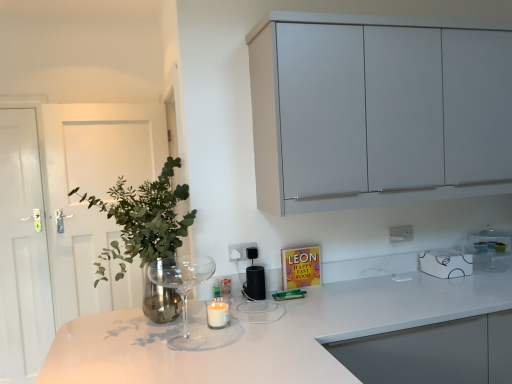
The image size is (512, 384). I want to click on free spot above white glossy door at left (from a real-world perspective), so click(14, 92).